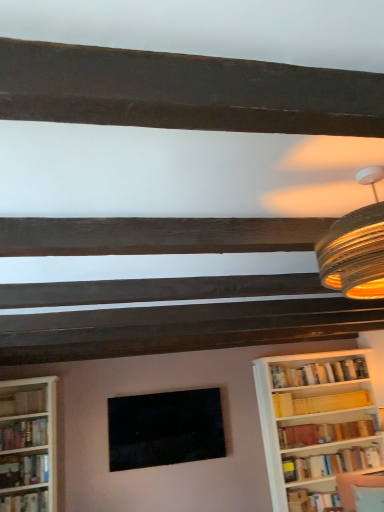
Question: Can you confirm if hardcover book at lower right, which appears as the third book when viewed from the right, is bigger than hardcover book at left, positioned as the 6th book in right-to-left order?

Choices:
 (A) yes
 (B) no

Answer: (B)

Question: Considering the relative sizes of hardcover book at lower right, the 5th book from the left, and hardcover book at left, which ranks as the second book in left-to-right order, in the image provided, is hardcover book at lower right, the 5th book from the left, taller than hardcover book at left, which ranks as the second book in left-to-right order,?

Choices:
 (A) yes
 (B) no

Answer: (B)

Question: Is hardcover book at lower right, which appears as the third book when viewed from the right, smaller than hardcover book at left, which ranks as the second book in left-to-right order?

Choices:
 (A) no
 (B) yes

Answer: (B)

Question: From a real-world perspective, is hardcover book at lower right, the 5th book from the left, on hardcover book at left, which ranks as the second book in left-to-right order?

Choices:
 (A) yes
 (B) no

Answer: (B)

Question: Is hardcover book at lower right, which appears as the third book when viewed from the right, touching hardcover book at left, positioned as the 6th book in right-to-left order?

Choices:
 (A) yes
 (B) no

Answer: (B)

Question: Based on their positions, is wooden bookshelf at left, placed as the seventh book when sorted from right to left, located to the left or right of hardcover book at lower right, the 5th book from the left?

Choices:
 (A) left
 (B) right

Answer: (A)

Question: From their relative heights in the image, would you say wooden bookshelf at left, placed as the seventh book when sorted from right to left, is taller or shorter than hardcover book at lower right, which appears as the third book when viewed from the right?

Choices:
 (A) short
 (B) tall

Answer: (B)

Question: From a real-world perspective, is wooden bookshelf at left, the first book viewed from the left, positioned above or below hardcover book at lower right, the 5th book from the left?

Choices:
 (A) above
 (B) below

Answer: (A)

Question: Considering the positions of wooden bookshelf at left, placed as the seventh book when sorted from right to left, and hardcover book at lower right, which appears as the third book when viewed from the right, in the image, is wooden bookshelf at left, placed as the seventh book when sorted from right to left, bigger or smaller than hardcover book at lower right, which appears as the third book when viewed from the right,?

Choices:
 (A) big
 (B) small

Answer: (A)

Question: Is velvet fabric swivel chair at lower right wider or thinner than matte black picture frame at center?

Choices:
 (A) wide
 (B) thin

Answer: (A)

Question: Based on their sizes in the image, would you say velvet fabric swivel chair at lower right is bigger or smaller than matte black picture frame at center?

Choices:
 (A) small
 (B) big

Answer: (A)

Question: Is point (339, 479) closer or farther from the camera than point (193, 424)?

Choices:
 (A) farther
 (B) closer

Answer: (A)

Question: Do you think velvet fabric swivel chair at lower right is within matte black picture frame at center, or outside of it?

Choices:
 (A) inside
 (B) outside

Answer: (B)

Question: From a real-world perspective, is hardcover book at lower right, which appears as the third book when viewed from the right, physically located above or below hardcover book at left, positioned as the 6th book in right-to-left order?

Choices:
 (A) above
 (B) below

Answer: (B)

Question: In terms of height, does hardcover book at lower right, the 5th book from the left, look taller or shorter compared to hardcover book at left, which ranks as the second book in left-to-right order?

Choices:
 (A) short
 (B) tall

Answer: (A)